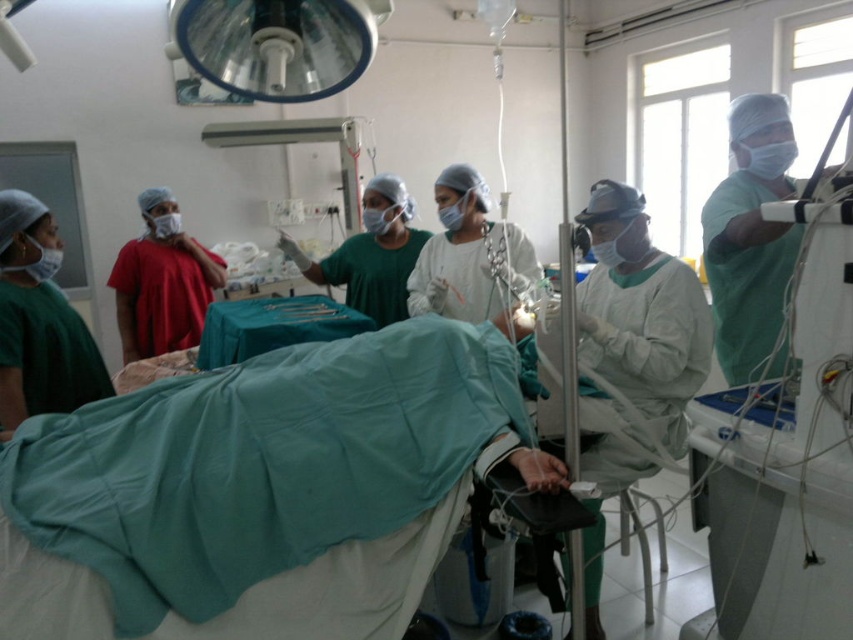
You are a medical student observing the surgical team in the operating room. You notice two medical staff members wearing green matte surgical gown at center and green matte scrubs at right. Which of these two is taller?

The green matte surgical gown at center is taller than the green matte scrubs at right.

You are a medical student observing the surgical procedure. You notice the green matte surgical gown at center and the metallic surgical instruments at center. Which object is positioned higher in the image?

The green matte surgical gown at center is much taller than the metallic surgical instruments at center, so it is positioned higher in the image.

You are a nurse preparing to sterilize the green matte surgical gown at center and the green matte scrubs at right. Which item requires a larger sterilization container?

The green matte surgical gown at center requires a larger sterilization container because it is larger in size than the green matte scrubs at right.